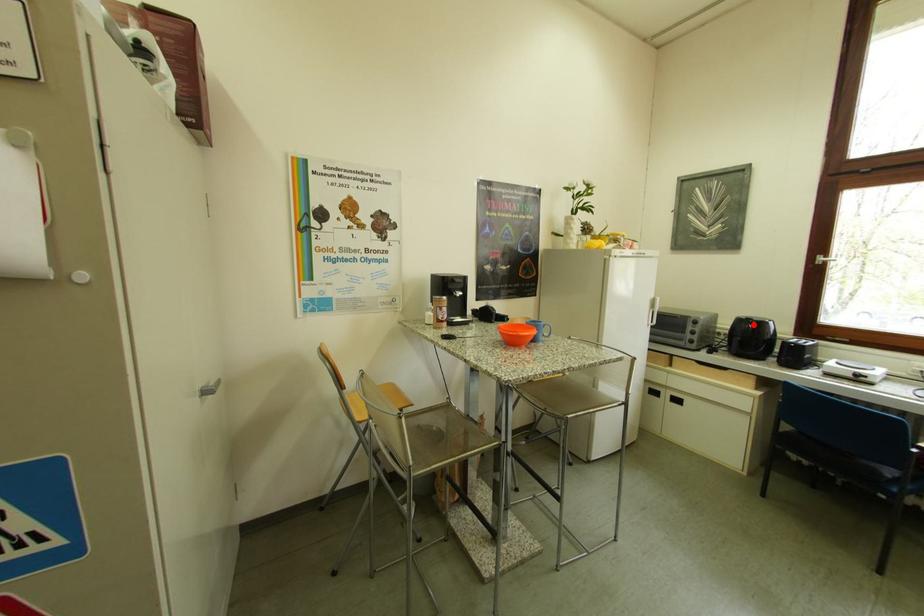
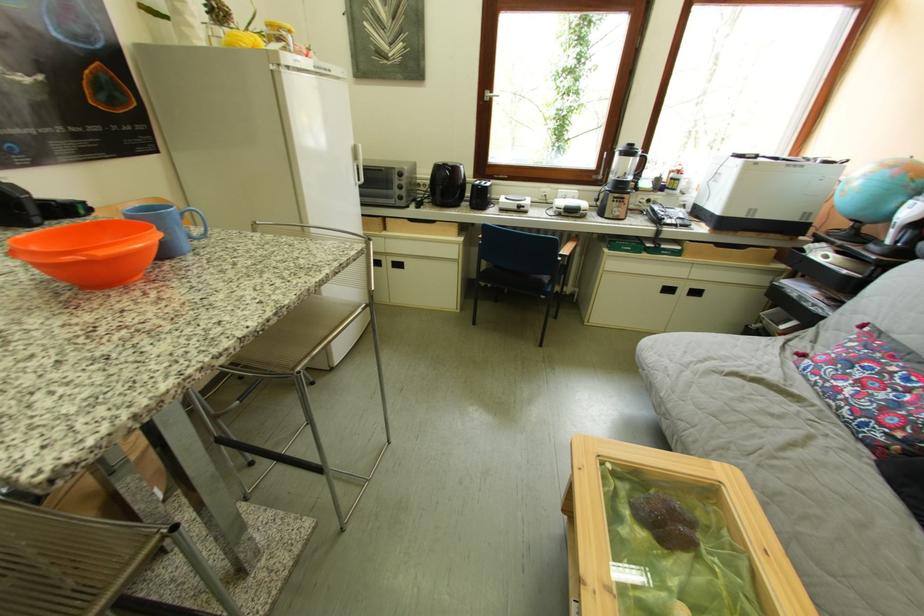
Question: I am providing you with two images of the same scene from different viewpoints. A red point is shown in image1. For the corresponding object point in image2, is it positioned nearer or farther from the camera?

Choices:
 (A) Nearer
 (B) Farther

Answer: (A)